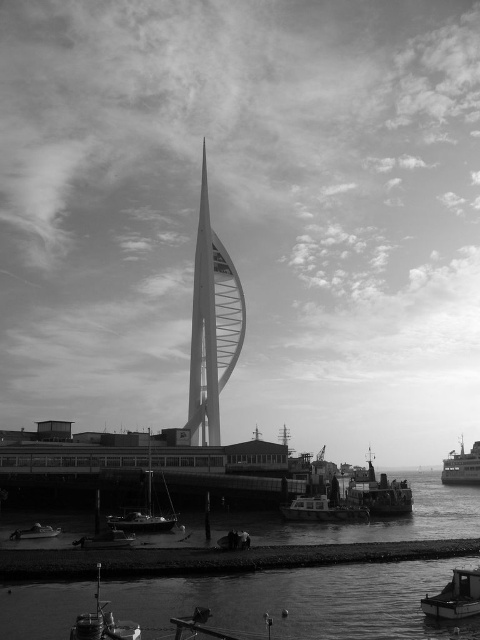
From the picture: You are a photographer planning to capture the waterfront scene. You want to ensure that the smooth water at lower center and the metallic sailboat at lower center are both clearly visible in your shot. Based on their relative sizes, which object should you prioritize framing closer to the edge of the frame to avoid overcrowding?

The smooth water at lower center is wider than the metallic sailboat at lower center, so you should prioritize framing the wider smooth water at lower center closer to the edge of the frame to avoid overcrowding.

You are a tour guide leading a group of visitors to the waterfront. You want to point out the distance between the smooth water at lower center and the metallic sailboat at lower center. How far apart are they?

The smooth water at lower center and the metallic sailboat at lower center are 19.11 meters apart from each other.

You are a photographer planning to capture both the metallic polished boat at lower center and the metallic gray ship at lower right in a single frame. Given their sizes, which one should you position closer to the center of the frame to ensure both are visible and balanced?

The metallic polished boat at lower center is smaller than the metallic gray ship at lower right, so to balance the composition, position the smaller boat closer to the center of the frame while placing the larger ship slightly off to the side.